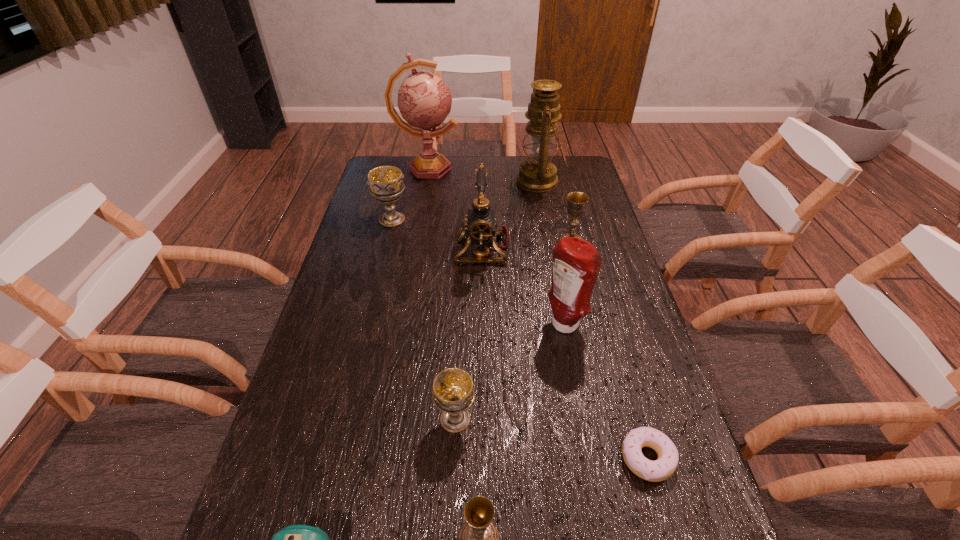
Identify the location of doughnut located at the right edge. The width and height of the screenshot is (960, 540). (661, 469).

Locate an element on the screen. object located in the far left corner section of the desktop is located at coordinates (424, 100).

Where is `object situated at the far right corner`? This screenshot has height=540, width=960. object situated at the far right corner is located at coordinates (537, 174).

What are the coordinates of `free region at the far edge` in the screenshot? It's located at (414, 176).

The width and height of the screenshot is (960, 540). What are the coordinates of `free space at the left edge of the desktop` in the screenshot? It's located at (382, 244).

Locate an element on the screen. The image size is (960, 540). free space at the right edge of the desktop is located at coordinates (606, 357).

Find the location of a particular element. The height and width of the screenshot is (540, 960). free space at the far left corner of the desktop is located at coordinates (410, 179).

At what (x,y) coordinates should I click in order to perform the action: click on free space between the white doughnut and the globe. Please return your answer as a coordinate pair (x, y). The height and width of the screenshot is (540, 960). Looking at the image, I should click on (538, 313).

You are a GUI agent. You are given a task and a screenshot of the screen. Output one action in this format:
    pyautogui.click(x=<x>, y=<y>)
    Task: Click on the unoccupied position between the globe and the white doughnut
    
    Given the screenshot: What is the action you would take?
    pyautogui.click(x=538, y=313)

Where is `empty space between the third farthest chalice and the pink globe`? The height and width of the screenshot is (540, 960). empty space between the third farthest chalice and the pink globe is located at coordinates [442, 293].